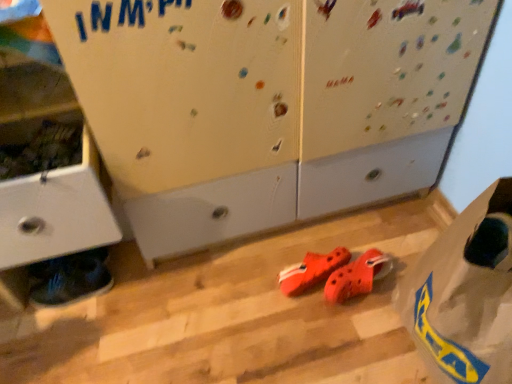
You are a GUI agent. You are given a task and a screenshot of the screen. Output one action in this format:
    pyautogui.click(x=<x>, y=<y>)
    Task: Click on the vacant area that is in front of orange rubber clogs at center, placed as the first footwear when sorted from right to left
    The image size is (512, 384).
    Given the screenshot: What is the action you would take?
    pyautogui.click(x=361, y=340)